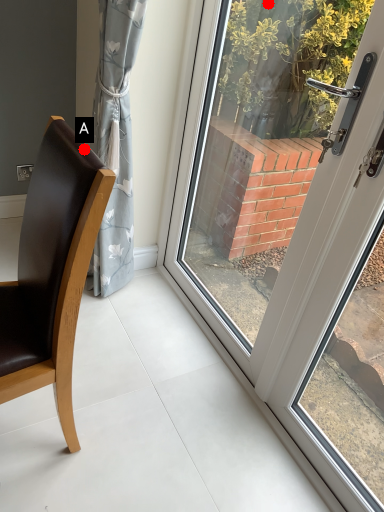
Question: Two points are circled on the image, labeled by A and B beside each circle. Which point appears closest to the camera in this image?

Choices:
 (A) A is closer
 (B) B is closer

Answer: (A)